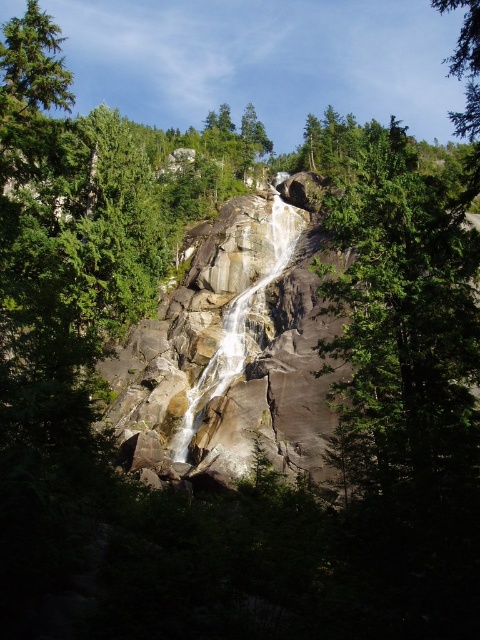
Question: In this image, where is smooth gray rock waterfall at center located relative to green textured tree at upper right?

Choices:
 (A) above
 (B) below

Answer: (B)

Question: Among these points, which one is farthest from the camera?

Choices:
 (A) (285, 234)
 (B) (454, 122)

Answer: (B)

Question: Which point appears farthest from the camera in this image?

Choices:
 (A) (465, 131)
 (B) (284, 246)

Answer: (B)

Question: Which object is closer to the camera taking this photo?

Choices:
 (A) green textured tree at upper right
 (B) smooth gray rock waterfall at center
 (C) green rough bark tree at center

Answer: (C)

Question: Is green rough bark tree at center to the right of green textured tree at upper right from the viewer's perspective?

Choices:
 (A) yes
 (B) no

Answer: (B)

Question: Does smooth gray rock waterfall at center appear on the right side of green textured tree at upper right?

Choices:
 (A) yes
 (B) no

Answer: (B)